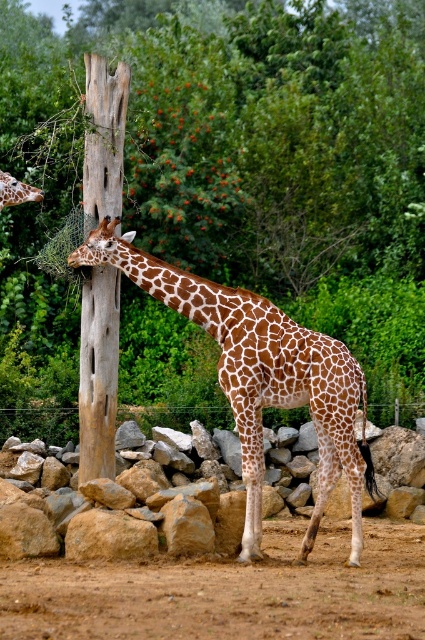
Who is more forward, [178,150] or [0,198]?

Point [0,198] is more forward.

This screenshot has height=640, width=425. I want to click on brown rough wood at center, so click(x=229, y=179).

Does point (337, 243) come farther from viewer compared to point (25, 188)?

Yes, point (337, 243) is farther from viewer.

Where is `brown rough wood at center`? brown rough wood at center is located at coordinates (229, 179).

Which is more to the right, brown sandy soil at lower center or brown spotted giraffe at center?

From the viewer's perspective, brown sandy soil at lower center appears more on the right side.

Locate an element on the screen. brown sandy soil at lower center is located at coordinates click(229, 592).

Which of these two, brown spotted giraffe at left or metal wire fence at lower center, stands taller?

With more height is brown spotted giraffe at left.

Is brown spotted giraffe at left smaller than metal wire fence at lower center?

No, brown spotted giraffe at left is not smaller than metal wire fence at lower center.

Is point (263, 385) in front of point (410, 408)?

Yes, it is in front of point (410, 408).

The width and height of the screenshot is (425, 640). Identify the location of brown spotted giraffe at left. (260, 376).